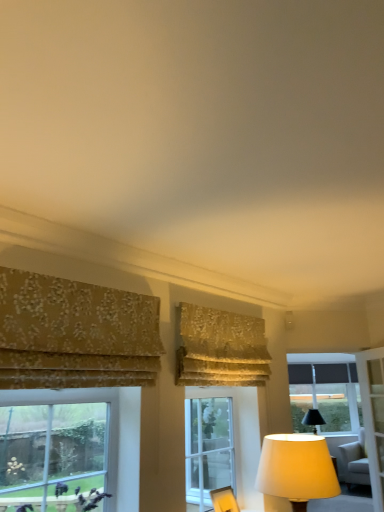
The width and height of the screenshot is (384, 512). What do you see at coordinates (108, 429) in the screenshot?
I see `clear glass window at lower left, which is the 1th window in top-to-bottom order` at bounding box center [108, 429].

What do you see at coordinates (325, 391) in the screenshot?
I see `black fabric window at right, which appears as the first window when viewed from the back` at bounding box center [325, 391].

In order to face floral fabric curtain at upper center, acting as the first curtain starting from the right, should I rotate leftwards or rightwards?

It's best to rotate right around 5.042 degrees.

Describe the element at coordinates (75, 334) in the screenshot. I see `gold floral fabric curtain at left, acting as the 1th curtain starting from the front` at that location.

Locate an element on the screen. The height and width of the screenshot is (512, 384). light gray fabric swivel chair at lower right is located at coordinates (355, 461).

Locate an element on the screen. Image resolution: width=384 pixels, height=512 pixels. clear glass window at upper right is located at coordinates [x=345, y=411].

From the image's perspective, which one is positioned higher, black fabric window at right, the third window in the left-to-right sequence, or clear glass window at center, which appears as the second window when viewed from the front?

clear glass window at center, which appears as the second window when viewed from the front, from the image's perspective.

Image resolution: width=384 pixels, height=512 pixels. Identify the location of the 1st window above the black fabric window at right, the first window positioned from the right (from the image's perspective). (223, 443).

Is black fabric window at right, which ranks as the third window in top-to-bottom order, not within clear glass window at center, which ranks as the second window in back-to-front order?

Yes, black fabric window at right, which ranks as the third window in top-to-bottom order, is located beyond the bounds of clear glass window at center, which ranks as the second window in back-to-front order.

Is gold floral fabric curtain at left, positioned as the first curtain in left-to-right order, smaller than light gray fabric swivel chair at lower right?

Correct, gold floral fabric curtain at left, positioned as the first curtain in left-to-right order, occupies less space than light gray fabric swivel chair at lower right.

Would you consider gold floral fabric curtain at left, placed as the second curtain when sorted from back to front, to be distant from light gray fabric swivel chair at lower right?

gold floral fabric curtain at left, placed as the second curtain when sorted from back to front, is positioned a significant distance from light gray fabric swivel chair at lower right.

Locate an element on the screen. This screenshot has height=512, width=384. swivel chair behind the gold floral fabric curtain at left, acting as the 1th curtain starting from the front is located at coordinates (355, 461).

Between clear glass window at upper right and black fabric window at right, which appears as the first window when viewed from the back, which one has smaller size?

Smaller between the two is black fabric window at right, which appears as the first window when viewed from the back.

Which object is wider, clear glass window at upper right or black fabric window at right, acting as the 1th window starting from the bottom?

clear glass window at upper right.

Could black fabric window at right, acting as the 1th window starting from the bottom, be considered to be inside clear glass window at upper right?

No.

From a real-world perspective, which is physically below, clear glass window at upper right or black fabric window at right, the third window in the left-to-right sequence?

clear glass window at upper right.

In the image, is gold floral fabric curtain at left, placed as the second curtain when sorted from back to front, positioned in front of or behind matte yellow fabric lampshade at lower right?

gold floral fabric curtain at left, placed as the second curtain when sorted from back to front, is positioned closer to the viewer than matte yellow fabric lampshade at lower right.

Can you tell me how much gold floral fabric curtain at left, positioned as the first curtain in left-to-right order, and matte yellow fabric lampshade at lower right differ in facing direction?

0.547 degrees separate the facing orientations of gold floral fabric curtain at left, positioned as the first curtain in left-to-right order, and matte yellow fabric lampshade at lower right.

Considering the positions of points (21, 313) and (299, 443), is point (21, 313) closer to camera compared to point (299, 443)?

Yes, point (21, 313) is closer to viewer.

From a real-world perspective, is gold floral fabric curtain at left, positioned as the first curtain in left-to-right order, physically above matte yellow fabric lampshade at lower right?

Yes, from a real-world perspective, gold floral fabric curtain at left, positioned as the first curtain in left-to-right order, is on top of matte yellow fabric lampshade at lower right.

In the scene shown: Which is correct: floral fabric curtain at upper center, placed as the 1th curtain when sorted from back to front, is inside light gray fabric swivel chair at lower right, or outside of it?

floral fabric curtain at upper center, placed as the 1th curtain when sorted from back to front, is not enclosed by light gray fabric swivel chair at lower right.

Does floral fabric curtain at upper center, placed as the 1th curtain when sorted from back to front, have a greater width compared to light gray fabric swivel chair at lower right?

Incorrect, the width of floral fabric curtain at upper center, placed as the 1th curtain when sorted from back to front, does not surpass that of light gray fabric swivel chair at lower right.

Which is less distant, [180,352] or [345,479]?

Point [180,352] is closer to the camera than point [345,479].

From the image's perspective, does floral fabric curtain at upper center, which ranks as the 2th curtain in left-to-right order, appear higher than light gray fabric swivel chair at lower right?

Indeed, from the image's perspective, floral fabric curtain at upper center, which ranks as the 2th curtain in left-to-right order, is shown above light gray fabric swivel chair at lower right.

In the scene shown: Is clear glass window at lower left, acting as the third window starting from the bottom, inside clear glass window at center, which ranks as the second window in back-to-front order?

No, clear glass window at lower left, acting as the third window starting from the bottom, is located outside of clear glass window at center, which ranks as the second window in back-to-front order.

Which object is positioned more to the left, clear glass window at center, which is the 2th window in top-to-bottom order, or clear glass window at lower left, the third window when ordered from back to front?

clear glass window at lower left, the third window when ordered from back to front, is more to the left.

Is clear glass window at center, which appears as the second window when viewed from the front, far away from clear glass window at lower left, the third window when ordered from back to front?

Yes.

What's the angular difference between black fabric window at right, acting as the 1th window starting from the bottom, and gold floral fabric curtain at left, acting as the 1th curtain starting from the front,'s facing directions?

45 degrees separate the facing orientations of black fabric window at right, acting as the 1th window starting from the bottom, and gold floral fabric curtain at left, acting as the 1th curtain starting from the front.

Considering the points (309, 374) and (141, 317), which point is behind, point (309, 374) or point (141, 317)?

The point (309, 374) is farther.

Looking at this image, considering the sizes of objects black fabric window at right, which ranks as the third window in front-to-back order, and gold floral fabric curtain at left, the second curtain in the right-to-left sequence, in the image provided, who is wider, black fabric window at right, which ranks as the third window in front-to-back order, or gold floral fabric curtain at left, the second curtain in the right-to-left sequence,?

gold floral fabric curtain at left, the second curtain in the right-to-left sequence, is wider.

Which object is positioned more to the right, black fabric window at right, the first window positioned from the right, or gold floral fabric curtain at left, placed as the second curtain when sorted from back to front?

black fabric window at right, the first window positioned from the right.

You are a GUI agent. You are given a task and a screenshot of the screen. Output one action in this format:
    pyautogui.click(x=<x>, y=<y>)
    Task: Click on the window behind the clear glass window at center, acting as the second window starting from the right
    
    Given the screenshot: What is the action you would take?
    pyautogui.click(x=325, y=391)

What are the coordinates of `the 1st curtain located above the light gray fabric swivel chair at lower right (from a real-world perspective)` in the screenshot? It's located at [x=75, y=334].

Which object lies nearer to the anchor point clear glass window at upper right, black fabric window at right, which ranks as the third window in front-to-back order, or floral fabric curtain at upper center, placed as the 1th curtain when sorted from back to front?

The object closer to clear glass window at upper right is black fabric window at right, which ranks as the third window in front-to-back order.

Based on the photo, which object lies further to the anchor point clear glass window at lower left, placed as the first window when sorted from front to back, matte yellow fabric lampshade at lower right or clear glass window at upper right?

Based on the image, clear glass window at upper right appears to be further to clear glass window at lower left, placed as the first window when sorted from front to back.

From the image, which object appears to be nearer to black fabric window at right, acting as the 1th window starting from the bottom, light gray fabric swivel chair at lower right or floral fabric curtain at upper center, placed as the 1th curtain when sorted from back to front?

Based on the image, light gray fabric swivel chair at lower right appears to be nearer to black fabric window at right, acting as the 1th window starting from the bottom.

Based on their spatial positions, is clear glass window at center, which is the 2th window in top-to-bottom order, or matte yellow fabric lampshade at lower right closer to clear glass window at lower left, the third window when ordered from back to front?

matte yellow fabric lampshade at lower right lies closer to clear glass window at lower left, the third window when ordered from back to front, than the other object.

Which object lies nearer to the anchor point floral fabric curtain at upper center, acting as the first curtain starting from the right, light gray fabric swivel chair at lower right or black fabric window at right, acting as the 1th window starting from the bottom?

black fabric window at right, acting as the 1th window starting from the bottom.

Estimate the real-world distances between objects in this image. Which object is closer to clear glass window at lower left, acting as the third window starting from the bottom, light gray fabric swivel chair at lower right or matte yellow fabric lampshade at lower right?

Among the two, matte yellow fabric lampshade at lower right is located nearer to clear glass window at lower left, acting as the third window starting from the bottom.

Which object lies further to the anchor point matte yellow fabric lampshade at lower right, floral fabric curtain at upper center, which is counted as the second curtain, starting from the front, or clear glass window at upper right?

clear glass window at upper right is positioned further to the anchor matte yellow fabric lampshade at lower right.

Consider the image. From the image, which object appears to be nearer to black fabric window at right, which appears as the first window when viewed from the back, light gray fabric swivel chair at lower right or clear glass window at center, which ranks as the second window in back-to-front order?

light gray fabric swivel chair at lower right.

Where is `curtain between clear glass window at lower left, which is the 1th window in top-to-bottom order, and light gray fabric swivel chair at lower right, along the z-axis`? curtain between clear glass window at lower left, which is the 1th window in top-to-bottom order, and light gray fabric swivel chair at lower right, along the z-axis is located at coordinates (220, 348).

Locate an element on the screen. lamp between gold floral fabric curtain at left, the second curtain in the right-to-left sequence, and black fabric window at right, which ranks as the third window in front-to-back order, from front to back is located at coordinates (296, 469).

Locate an element on the screen. curtain positioned between gold floral fabric curtain at left, positioned as the first curtain in left-to-right order, and black fabric window at right, which ranks as the third window in front-to-back order, from near to far is located at coordinates (220, 348).

This screenshot has width=384, height=512. In order to click on window frame between floral fabric curtain at upper center, acting as the first curtain starting from the right, and light gray fabric swivel chair at lower right, along the z-axis in this screenshot , I will do `click(345, 411)`.